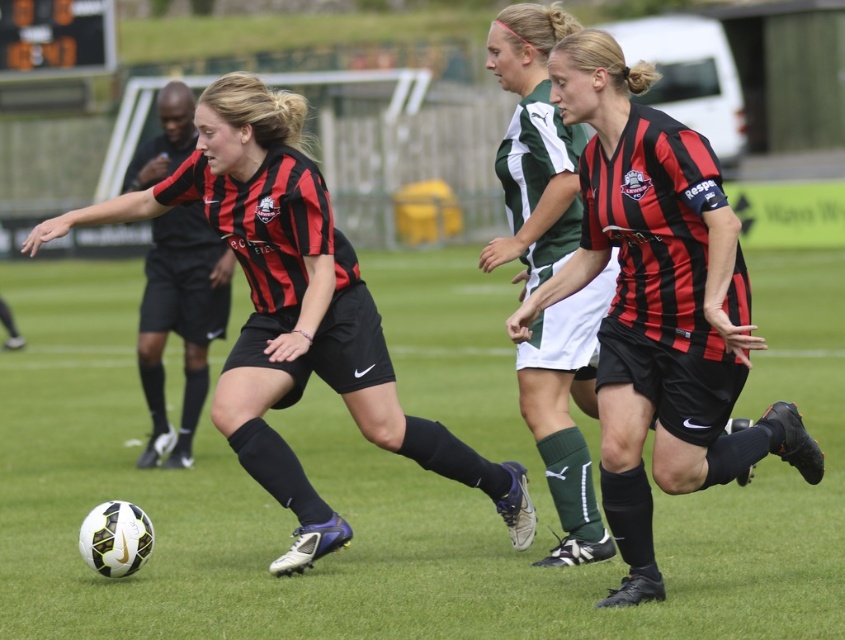
You are a soccer coach analyzing the field setup. The green artificial turf at center and matte black shorts at center are both in the central area. Which one has a greater width?

The green artificial turf at center has a greater width than the matte black shorts at center according to the description.

Looking at this image, you are a soccer coach observing the match. You notice the matte black soccer ball at lower left and the matte black shorts at center. Which object is located to the left of the other?

The matte black soccer ball at lower left is positioned on the left side of matte black shorts at center.

You are a soccer player positioned at the edge of the field and need to quickly pass the ball to the matte black shorts at center. The black matte referee at center is in your passing path. Can you safely make the pass without the ball going past the referee? Please consider the distance between them.

The matte black shorts at center is 4.54 meters away from the black matte referee at center. Since the distance between them is over 4 meters, you can safely pass the ball to the matte black shorts at center without it going past the referee.